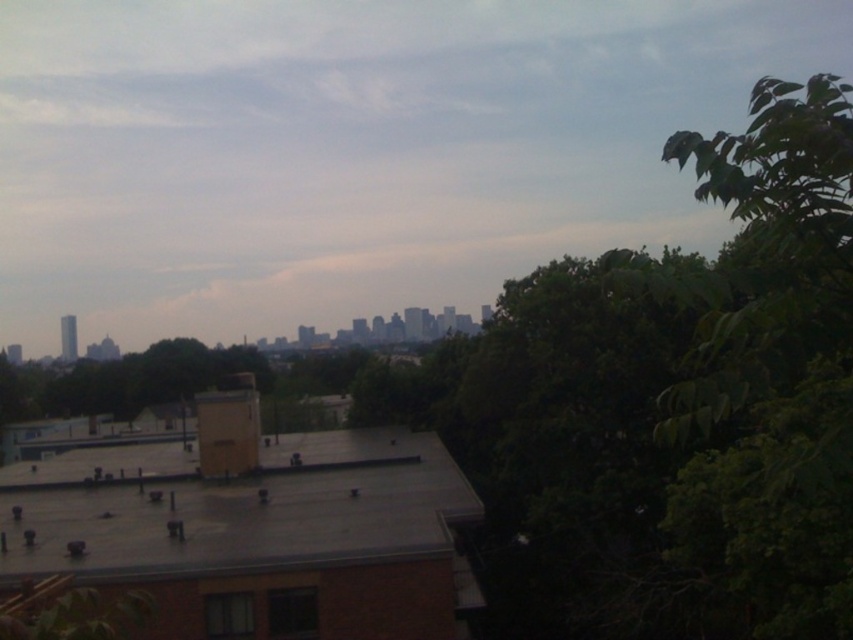
Is point (741, 516) positioned after point (135, 467)?

That is False.

Can you confirm if green leafy tree at right is bigger than gray rubber roof at center?

Yes.

Which is behind, point (723, 355) or point (410, 506)?

The point (410, 506) is behind.

Where is `green leafy tree at right`? The width and height of the screenshot is (853, 640). green leafy tree at right is located at coordinates (773, 365).